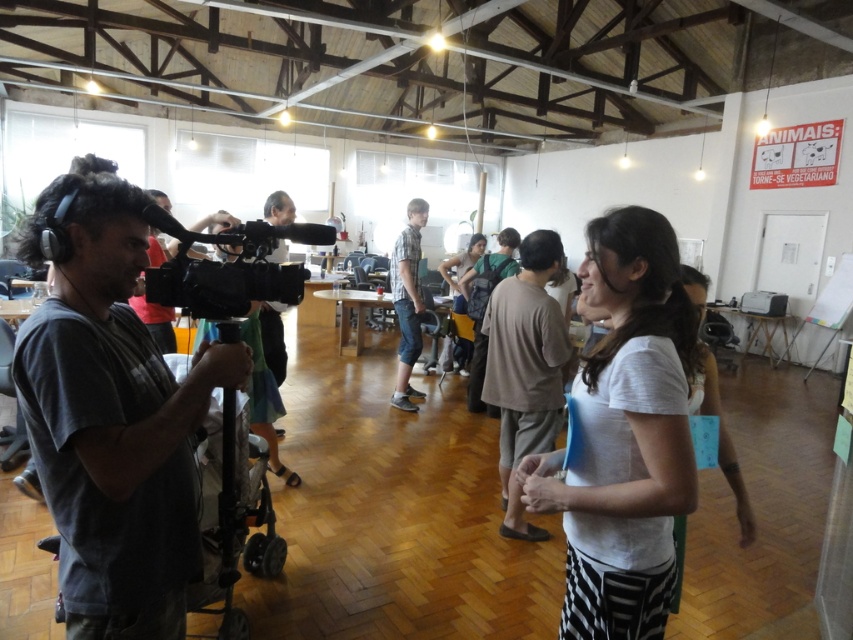
Which is more to the right, white cotton shirt at center or plaid cotton shirt at center?

From the viewer's perspective, white cotton shirt at center appears more on the right side.

You are a GUI agent. You are given a task and a screenshot of the screen. Output one action in this format:
    pyautogui.click(x=<x>, y=<y>)
    Task: Click on the white cotton shirt at center
    The height and width of the screenshot is (640, 853).
    Given the screenshot: What is the action you would take?
    pos(624,435)

Where is `white cotton shirt at center`? white cotton shirt at center is located at coordinates (624, 435).

Can you confirm if black plastic video camera at center is positioned above dark gray backpack at center?

Correct, black plastic video camera at center is located above dark gray backpack at center.

This screenshot has width=853, height=640. Identify the location of black plastic video camera at center. (229, 268).

Where is `dark gray shirt at left`? dark gray shirt at left is located at coordinates (111, 413).

Is dark gray shirt at left in front of white cotton shirt at center?

Yes, dark gray shirt at left is in front of white cotton shirt at center.

Find the location of a particular element. This screenshot has height=640, width=853. dark gray shirt at left is located at coordinates (111, 413).